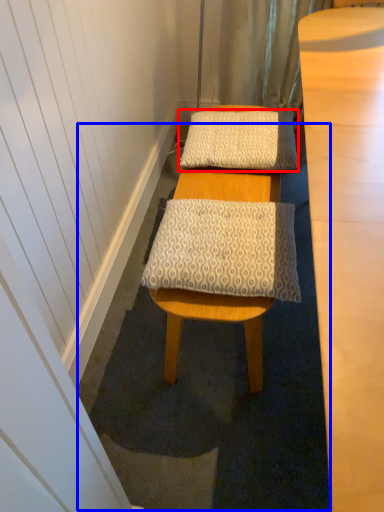
Question: Which object is further to the camera taking this photo, pillow (highlighted by a red box) or bath mat (highlighted by a blue box)?

Choices:
 (A) pillow
 (B) bath mat

Answer: (A)